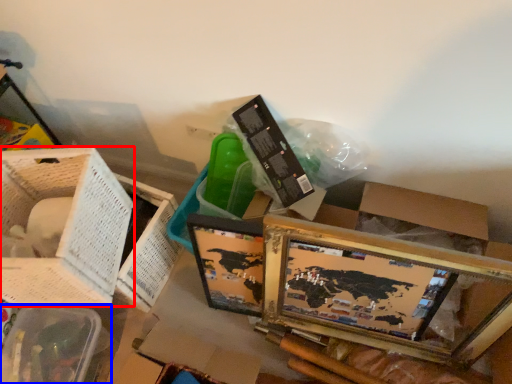
Question: Which of the following is the closest to the observer, basket (highlighted by a red box) or basket (highlighted by a blue box)?

Choices:
 (A) basket
 (B) basket

Answer: (A)